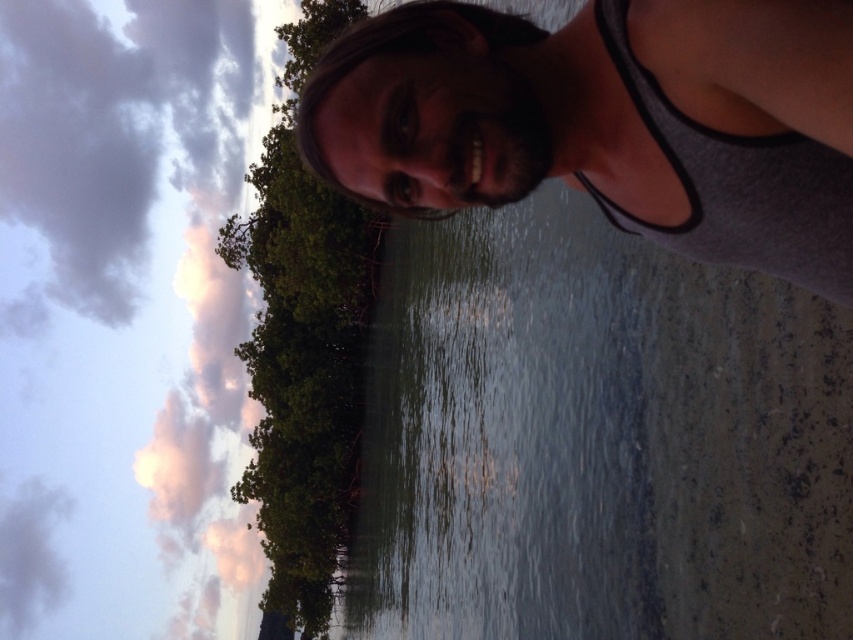
Who is positioned more to the left, pink fluffy cloud at upper left or gray fabric tank top at upper center?

pink fluffy cloud at upper left

Between pink fluffy cloud at upper left and gray fabric tank top at upper center, which one has less height?

gray fabric tank top at upper center

Identify the location of pink fluffy cloud at upper left. (126, 314).

Describe the element at coordinates (608, 122) in the screenshot. I see `gray fabric tank top at upper center` at that location.

Consider the image. Does gray fabric tank top at upper center have a smaller size compared to green leafy tree at center?

Yes.

I want to click on gray fabric tank top at upper center, so click(x=608, y=122).

Does pink fluffy cloud at upper left have a greater height compared to green leafy tree at center?

Indeed, pink fluffy cloud at upper left has a greater height compared to green leafy tree at center.

Does point (61, 28) come behind point (270, 156)?

That is True.

This screenshot has height=640, width=853. I want to click on pink fluffy cloud at upper left, so click(126, 314).